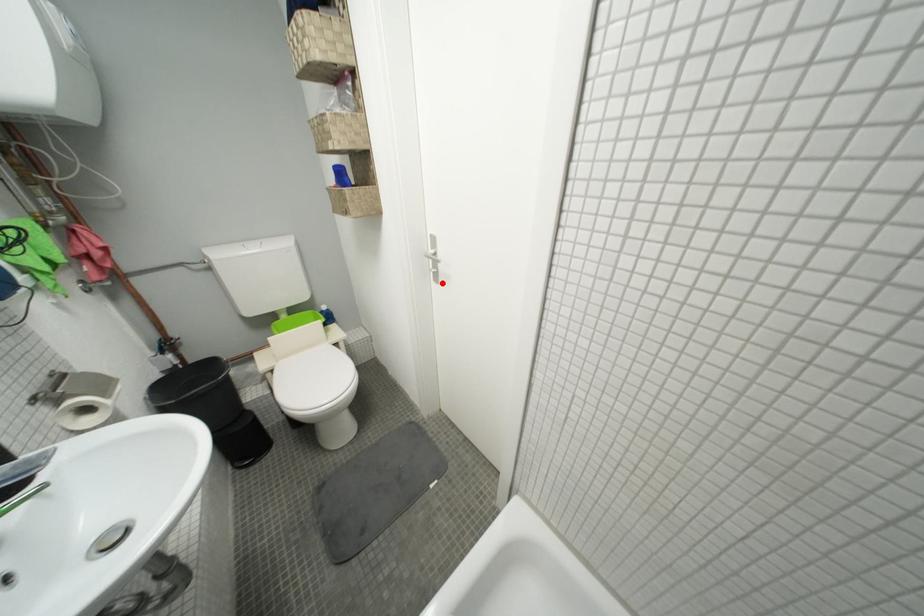
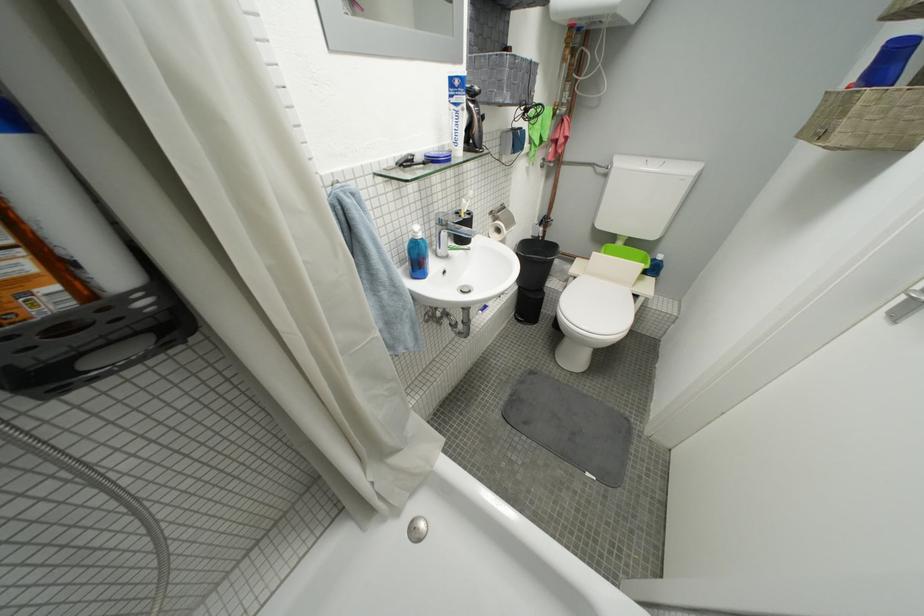
Question: I am providing you with two images of the same scene from different viewpoints. Given a red point in image1, look at the same physical point in image2. Is it:

Choices:
 (A) Closer to the viewpoint
 (B) Farther from the viewpoint

Answer: (B)